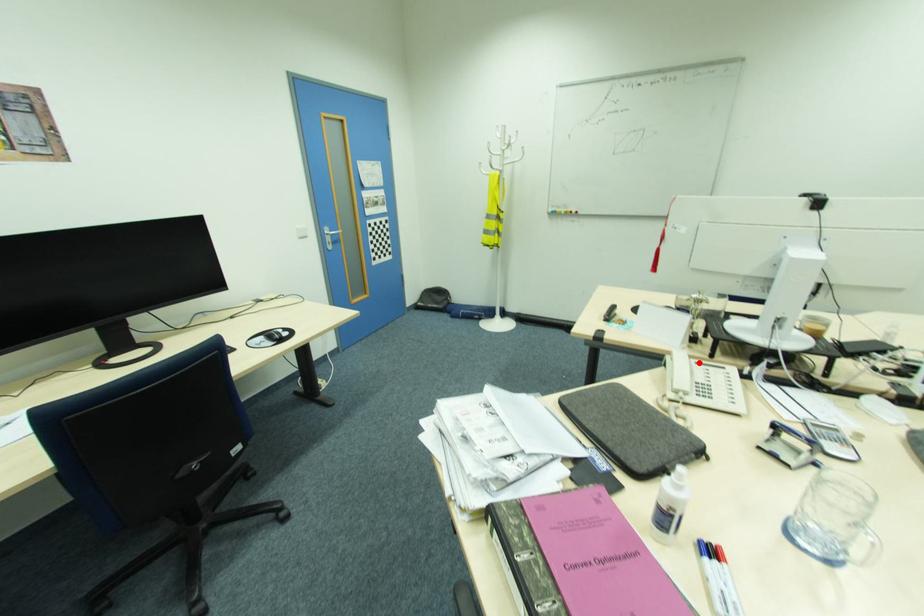
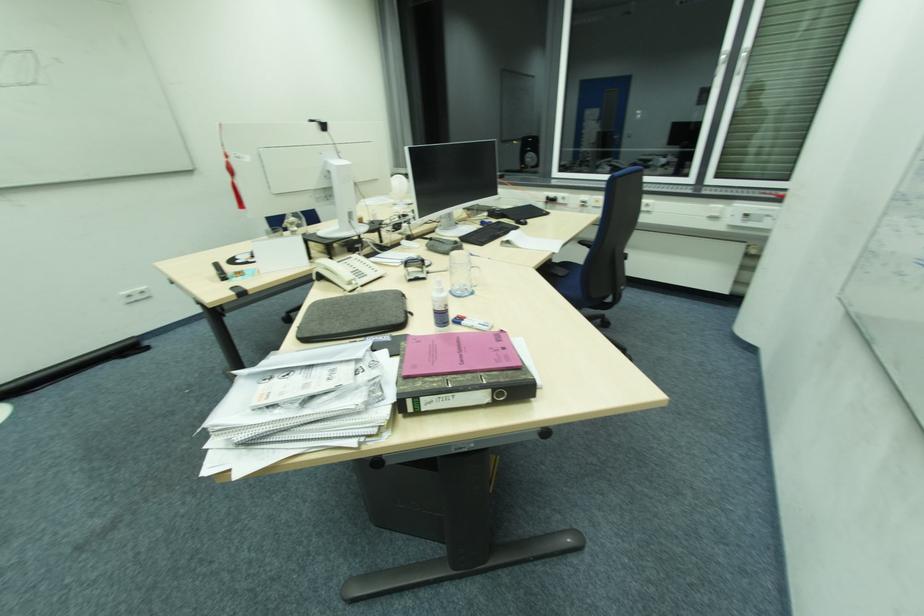
Find the pixel in the second image that matches the highlighted location in the first image.

(342, 262)